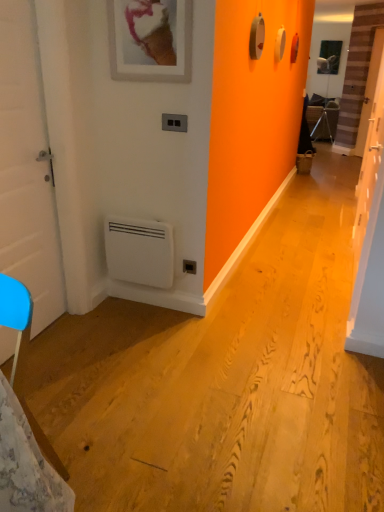
Question: Visually, is black plastic electric outlet at lower center positioned to the left or to the right of white matte door at left, which is counted as the 2th door, starting from the right?

Choices:
 (A) left
 (B) right

Answer: (B)

Question: Is black plastic electric outlet at lower center inside or outside of white matte door at left, which is counted as the 2th door, starting from the right?

Choices:
 (A) inside
 (B) outside

Answer: (B)

Question: Which object is positioned farthest from the black plastic electric outlet at lower center?

Choices:
 (A) black plastic/light switch at upper center
 (B) white plastic air conditioning unit at lower left
 (C) white glossy door at right, which is the 2th door in left-to-right order
 (D) matte white picture frame at upper center
 (E) white matte door at left, which is counted as the 2th door, starting from the right

Answer: (C)

Question: Which of these objects is positioned closest to the black plastic/light switch at upper center?

Choices:
 (A) matte white picture frame at upper center
 (B) white matte door at left, acting as the first door starting from the left
 (C) white glossy door at right, placed as the first door when sorted from right to left
 (D) black plastic electric outlet at lower center
 (E) white plastic air conditioning unit at lower left

Answer: (A)